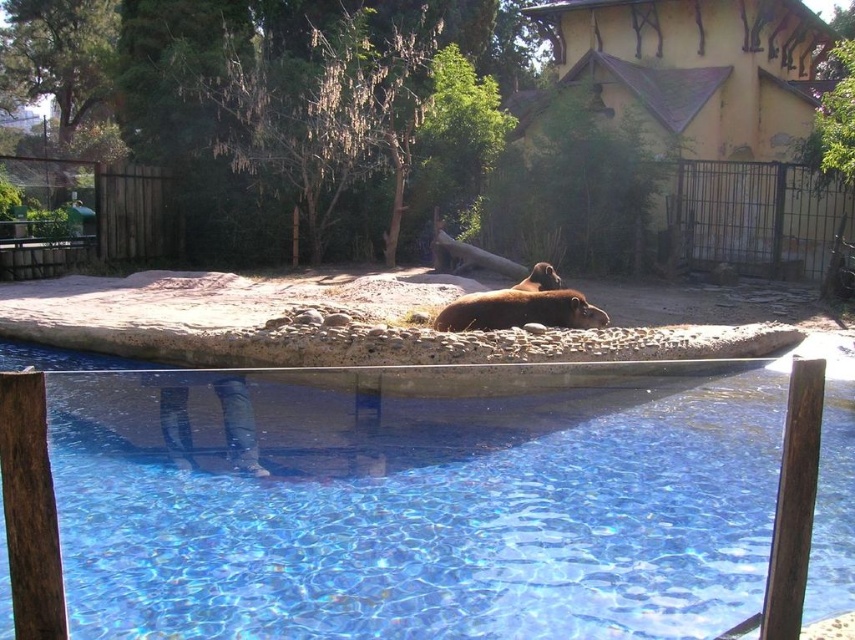
You are a zookeeper planning to install a new feeding station for the hippos. The feeding station must be placed outside the transparent glass swimming pool at center. Based on the coordinates provided, where should you position the feeding station?

The transparent glass swimming pool at center is located at coordinates point (416, 500). To place the feeding station outside the pool, the zookeeper should choose a location with coordinates not overlapping with this point, ensuring it is positioned away from the pool area.